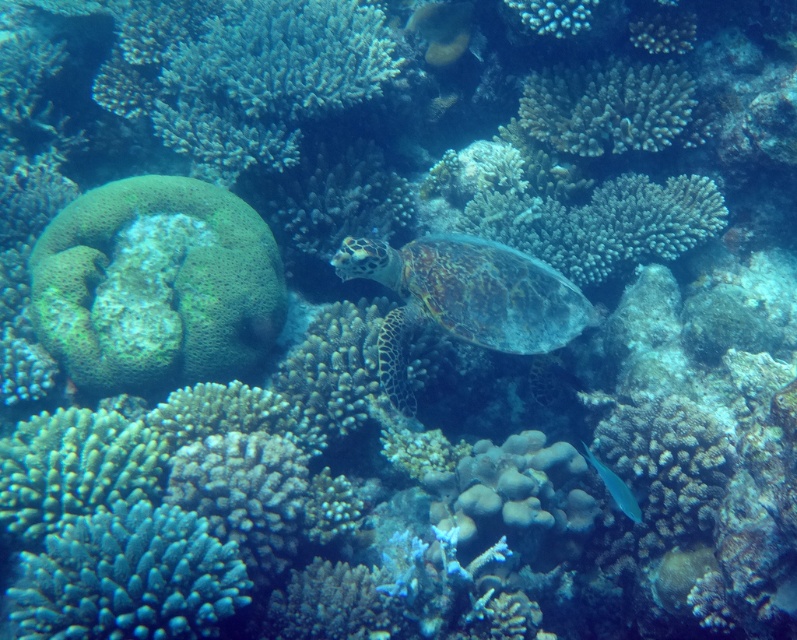
Question: Where is green porous coral at center located in relation to rough textured coral at upper center in the image?

Choices:
 (A) above
 (B) below

Answer: (B)

Question: Which is nearer to the greenish-brown textured shell at center?

Choices:
 (A) blue glossy fish at lower right
 (B) green porous coral at center
 (C) rough textured coral at upper center

Answer: (A)

Question: Is greenish-brown textured shell at center smaller than blue glossy fish at lower right?

Choices:
 (A) no
 (B) yes

Answer: (A)

Question: Is the position of green porous coral at center more distant than that of greenish-brown textured shell at center?

Choices:
 (A) yes
 (B) no

Answer: (B)

Question: Which is farther from the blue glossy fish at lower right?

Choices:
 (A) rough textured coral at upper center
 (B) greenish-brown textured shell at center

Answer: (A)

Question: Which of the following is the closest to the observer?

Choices:
 (A) rough textured coral at upper center
 (B) greenish-brown textured shell at center
 (C) blue glossy fish at lower right
 (D) green porous coral at center

Answer: (C)